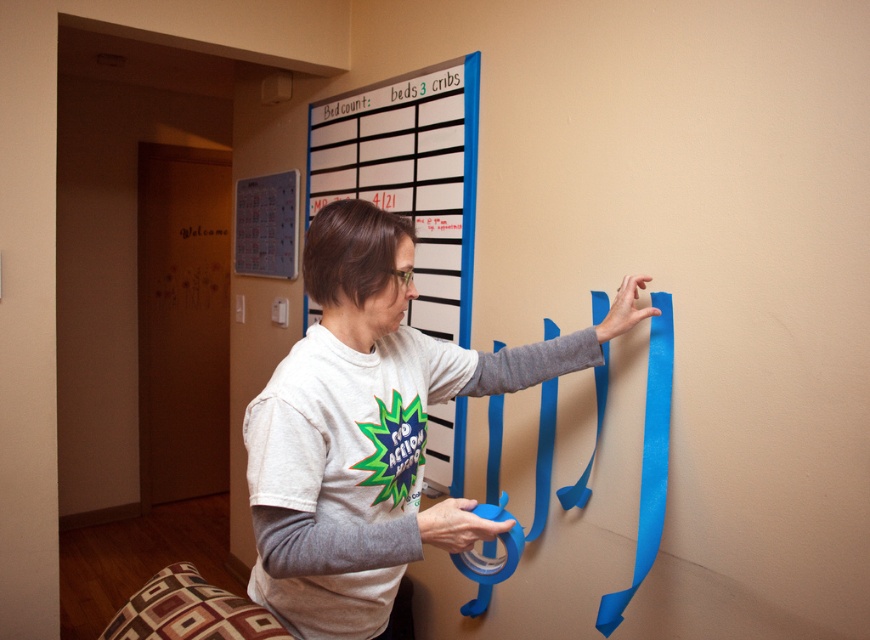
You are helping someone decorate a wall. You see two pieces of tape at the center of the wall. One is labeled as matte blue tape at center and the other is blue matte tape at center. Which one is bigger?

The matte blue tape at center is larger in size than the blue matte tape at center.

You are a painter trying to place a sticker on the wall. You have two points marked on the wall where you need to place stickers. The first point is at coordinates point (429, 188) and the second is at point (648, 413). From your current position, which point is closer to you?

Point (648, 413) is closer to you because it is in front of point (429, 188).

You are an interior designer planning to hang a picture frame that requires precise placement. The frame is 30 cm wide and needs to be centered between the matte blue tape at center and the edge of the whiteboard. Where should you position the frame?

The matte blue tape at center is located at point (371, 428). To center the 30 cm wide frame between it and the whiteboard edge, measure halfway between these two points and align the frame there.